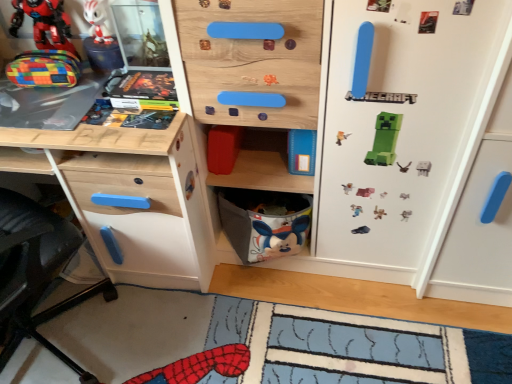
Image resolution: width=512 pixels, height=384 pixels. Describe the element at coordinates (45, 23) in the screenshot. I see `matte plastic toy at upper left, positioned as the second toy in top-to-bottom order` at that location.

Image resolution: width=512 pixels, height=384 pixels. I want to click on white glossy figurine at upper left, marked as the third toy in a bottom-to-top arrangement, so click(x=98, y=21).

What do you see at coordinates (44, 69) in the screenshot? I see `multicolored fabric pouch at left, which is the third toy from top to bottom` at bounding box center [44, 69].

What is the approximate width of multicolored fabric pouch at left, positioned as the 1th toy in bottom-to-top order?

It is 10.40 centimeters.

I want to click on white matte fridge at center, so click(x=404, y=128).

The width and height of the screenshot is (512, 384). In order to click on hardcover comic book at upper left in this screenshot , I will do `click(145, 88)`.

What is the approximate height of wooden board game at upper left?

wooden board game at upper left is 10.38 inches tall.

Identify the location of matte plastic toy at upper left, placed as the second toy when sorted from bottom to top. (45, 23).

Measure the distance between gray fabric basket at lower center and wooden board game at upper left.

gray fabric basket at lower center and wooden board game at upper left are 25.89 inches apart.

In terms of width, does gray fabric basket at lower center look wider or thinner when compared to wooden board game at upper left?

Considering their sizes, gray fabric basket at lower center looks broader than wooden board game at upper left.

Between gray fabric basket at lower center and wooden board game at upper left, which one has less height?

Standing shorter between the two is wooden board game at upper left.

Which object is positioned more to the right, gray fabric basket at lower center or wooden board game at upper left?

gray fabric basket at lower center is more to the right.

How many degrees apart are the facing directions of hardcover comic book at upper left and wooden board game at upper left?

They differ by 0.283 degrees in their facing directions.

From the image's perspective, is hardcover comic book at upper left above or below wooden board game at upper left?

From the image's perspective, hardcover comic book at upper left appears below wooden board game at upper left.

Is wooden board game at upper left at the back of hardcover comic book at upper left?

Yes.

Considering the relative sizes of hardcover comic book at upper left and wooden board game at upper left in the image provided, is hardcover comic book at upper left wider than wooden board game at upper left?

In fact, hardcover comic book at upper left might be narrower than wooden board game at upper left.

Is wooden desk at left wider than multicolored fabric pouch at left, positioned as the 1th toy in bottom-to-top order?

Indeed, wooden desk at left has a greater width compared to multicolored fabric pouch at left, positioned as the 1th toy in bottom-to-top order.

Based on the photo, is wooden desk at left aimed at multicolored fabric pouch at left, which is the third toy from top to bottom?

Yes, wooden desk at left is turned towards multicolored fabric pouch at left, which is the third toy from top to bottom.

From a real-world perspective, does wooden desk at left stand above multicolored fabric pouch at left, positioned as the 1th toy in bottom-to-top order?

No.

Is wooden desk at left beside multicolored fabric pouch at left, positioned as the 1th toy in bottom-to-top order?

They are not placed beside each other.

Between wooden board game at upper left and matte plastic toy at upper left, positioned as the second toy in top-to-bottom order, which one appears on the left side from the viewer's perspective?

matte plastic toy at upper left, positioned as the second toy in top-to-bottom order, is more to the left.

Which of these two, wooden board game at upper left or matte plastic toy at upper left, placed as the second toy when sorted from bottom to top, is thinner?

With smaller width is matte plastic toy at upper left, placed as the second toy when sorted from bottom to top.

Are wooden board game at upper left and matte plastic toy at upper left, positioned as the second toy in top-to-bottom order, located far from each other?

wooden board game at upper left is actually quite close to matte plastic toy at upper left, positioned as the second toy in top-to-bottom order.

From their relative heights in the image, would you say wooden board game at upper left is taller or shorter than matte plastic toy at upper left, placed as the second toy when sorted from bottom to top?

In the image, wooden board game at upper left appears to be shorter than matte plastic toy at upper left, placed as the second toy when sorted from bottom to top.

Is white glossy figurine at upper left, marked as the third toy in a bottom-to-top arrangement, to the right of multicolored fabric pouch at left, which is the third toy from top to bottom, from the viewer's perspective?

Yes.

Does point (93, 18) come farther from viewer compared to point (40, 50)?

No, (93, 18) is in front of (40, 50).

Relative to multicolored fabric pouch at left, which is the third toy from top to bottom, is white glossy figurine at upper left, marked as the third toy in a bottom-to-top arrangement, in front or behind?

Clearly, white glossy figurine at upper left, marked as the third toy in a bottom-to-top arrangement, is behind multicolored fabric pouch at left, which is the third toy from top to bottom.

Which object is wider, white glossy figurine at upper left, marked as the third toy in a bottom-to-top arrangement, or multicolored fabric pouch at left, positioned as the 1th toy in bottom-to-top order?

With larger width is multicolored fabric pouch at left, positioned as the 1th toy in bottom-to-top order.

Considering the positions of objects hardcover comic book at upper left and matte plastic toy at upper left, placed as the second toy when sorted from bottom to top, in the image provided, who is in front, hardcover comic book at upper left or matte plastic toy at upper left, placed as the second toy when sorted from bottom to top,?

hardcover comic book at upper left is more forward.

Is hardcover comic book at upper left outside of matte plastic toy at upper left, placed as the second toy when sorted from bottom to top?

Indeed, hardcover comic book at upper left is completely outside matte plastic toy at upper left, placed as the second toy when sorted from bottom to top.

Could you tell me if hardcover comic book at upper left is facing matte plastic toy at upper left, positioned as the second toy in top-to-bottom order?

No, hardcover comic book at upper left is not aimed at matte plastic toy at upper left, positioned as the second toy in top-to-bottom order.

Looking at their sizes, would you say hardcover comic book at upper left is wider or thinner than matte plastic toy at upper left, placed as the second toy when sorted from bottom to top?

Clearly, hardcover comic book at upper left has more width compared to matte plastic toy at upper left, placed as the second toy when sorted from bottom to top.

Considering the sizes of objects wooden desk at left and gray fabric basket at lower center in the image provided, who is shorter, wooden desk at left or gray fabric basket at lower center?

Standing shorter between the two is gray fabric basket at lower center.

Is gray fabric basket at lower center at the back of wooden desk at left?

No, wooden desk at left's orientation is not away from gray fabric basket at lower center.

Locate an element on the screen. This screenshot has height=384, width=512. the chest of drawers that is above the gray fabric basket at lower center (from a real-world perspective) is located at coordinates (135, 195).

Does wooden desk at left appear on the left side of gray fabric basket at lower center?

Yes.

Locate an element on the screen. cabinet below the wooden board game at upper left (from the image's perspective) is located at coordinates (264, 222).

Locate an element on the screen. shelf lying in front of the hardcover comic book at upper left is located at coordinates (140, 33).

Which object lies nearer to the anchor point matte plastic toy at upper left, placed as the second toy when sorted from bottom to top, white glossy figurine at upper left, placed as the 1th toy when sorted from top to bottom, or multicolored fabric pouch at left, which is the third toy from top to bottom?

multicolored fabric pouch at left, which is the third toy from top to bottom.

Considering their positions, is multicolored fabric pouch at left, which is the third toy from top to bottom, positioned further to gray fabric basket at lower center than matte plastic toy at upper left, positioned as the second toy in top-to-bottom order?

matte plastic toy at upper left, positioned as the second toy in top-to-bottom order, is positioned further to the anchor gray fabric basket at lower center.

Based on their spatial positions, is multicolored fabric pouch at left, positioned as the 1th toy in bottom-to-top order, or wooden desk at left closer to matte plastic toy at upper left, positioned as the second toy in top-to-bottom order?

multicolored fabric pouch at left, positioned as the 1th toy in bottom-to-top order, lies closer to matte plastic toy at upper left, positioned as the second toy in top-to-bottom order, than the other object.

Looking at the image, which one is located further to matte plastic toy at upper left, positioned as the second toy in top-to-bottom order, gray fabric basket at lower center or hardcover comic book at upper left?

The object further to matte plastic toy at upper left, positioned as the second toy in top-to-bottom order, is gray fabric basket at lower center.

Which object lies further to the anchor point wooden desk at left, white matte fridge at center or multicolored fabric pouch at left, positioned as the 1th toy in bottom-to-top order?

white matte fridge at center is positioned further to the anchor wooden desk at left.

From the picture: Based on their spatial positions, is hardcover comic book at upper left or white matte fridge at center further from wooden desk at left?

white matte fridge at center is further to wooden desk at left.

Based on their spatial positions, is wooden board game at upper left or gray fabric basket at lower center closer to hardcover comic book at upper left?

Among the two, wooden board game at upper left is located nearer to hardcover comic book at upper left.

Considering their positions, is hardcover comic book at upper left positioned further to multicolored fabric pouch at left, positioned as the 1th toy in bottom-to-top order, than matte plastic toy at upper left, positioned as the second toy in top-to-bottom order?

Among the two, hardcover comic book at upper left is located further to multicolored fabric pouch at left, positioned as the 1th toy in bottom-to-top order.

Find the location of a particular element. The image size is (512, 384). cabinet located between wooden desk at left and white matte fridge at center in the left-right direction is located at coordinates point(264,222).

Identify the location of shelf between matte plastic toy at upper left, placed as the second toy when sorted from bottom to top, and white matte fridge at center. (140, 33).

I want to click on shelf between matte plastic toy at upper left, positioned as the second toy in top-to-bottom order, and gray fabric basket at lower center from left to right, so click(x=140, y=33).

The height and width of the screenshot is (384, 512). What are the coordinates of `shelf between white glossy figurine at upper left, placed as the 1th toy when sorted from top to bottom, and gray fabric basket at lower center, in the vertical direction` in the screenshot? It's located at (140, 33).